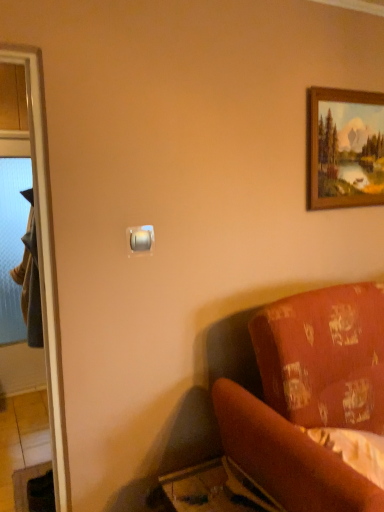
Question: Considering the positions of point (36, 304) and point (372, 158), is point (36, 304) closer or farther from the camera than point (372, 158)?

Choices:
 (A) farther
 (B) closer

Answer: (A)

Question: From a real-world perspective, is dark gray fabric robe at left physically located above or below wooden picture frame at upper right?

Choices:
 (A) below
 (B) above

Answer: (A)

Question: Estimate the real-world distances between objects in this image. Which object is farther from the dark gray fabric robe at left?

Choices:
 (A) satin gold switch at upper center
 (B) velvet-like red couch at lower right
 (C) wooden picture frame at upper right

Answer: (C)

Question: Estimate the real-world distances between objects in this image. Which object is closer to the dark gray fabric robe at left?

Choices:
 (A) wooden picture frame at upper right
 (B) satin gold switch at upper center
 (C) velvet-like red couch at lower right

Answer: (B)